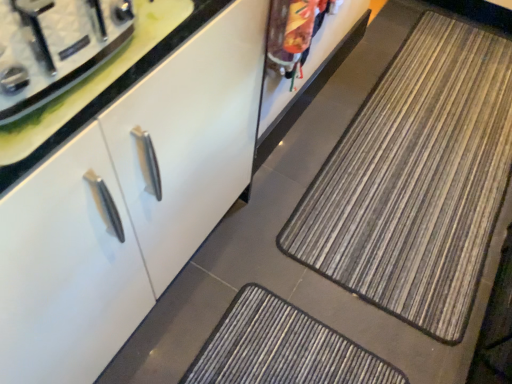
Question: Can brushed metal stove top at upper left be found inside striped fabric mat at center?

Choices:
 (A) no
 (B) yes

Answer: (A)

Question: From a real-world perspective, is striped fabric mat at center positioned under brushed metal stove top at upper left based on gravity?

Choices:
 (A) yes
 (B) no

Answer: (A)

Question: From a real-world perspective, is striped fabric mat at center on top of brushed metal stove top at upper left?

Choices:
 (A) yes
 (B) no

Answer: (B)

Question: Is striped fabric mat at center at the left side of brushed metal stove top at upper left?

Choices:
 (A) yes
 (B) no

Answer: (B)

Question: Is striped fabric mat at center taller than brushed metal stove top at upper left?

Choices:
 (A) no
 (B) yes

Answer: (A)

Question: Is striped fabric mat at center directly adjacent to brushed metal stove top at upper left?

Choices:
 (A) no
 (B) yes

Answer: (A)

Question: Considering the relative positions of white glossy cabinet at center and brushed metal stove top at upper left in the image provided, is white glossy cabinet at center to the left of brushed metal stove top at upper left from the viewer's perspective?

Choices:
 (A) no
 (B) yes

Answer: (B)

Question: Is white glossy cabinet at center located outside brushed metal stove top at upper left?

Choices:
 (A) yes
 (B) no

Answer: (A)

Question: Can you confirm if white glossy cabinet at center is shorter than brushed metal stove top at upper left?

Choices:
 (A) no
 (B) yes

Answer: (A)

Question: From a real-world perspective, is white glossy cabinet at center positioned under brushed metal stove top at upper left based on gravity?

Choices:
 (A) yes
 (B) no

Answer: (A)

Question: From a real-world perspective, is white glossy cabinet at center positioned over brushed metal stove top at upper left based on gravity?

Choices:
 (A) no
 (B) yes

Answer: (A)

Question: Does white glossy cabinet at center touch brushed metal stove top at upper left?

Choices:
 (A) no
 (B) yes

Answer: (A)

Question: From the image's perspective, is brushed metal stove top at upper left over striped fabric mat at center?

Choices:
 (A) yes
 (B) no

Answer: (B)